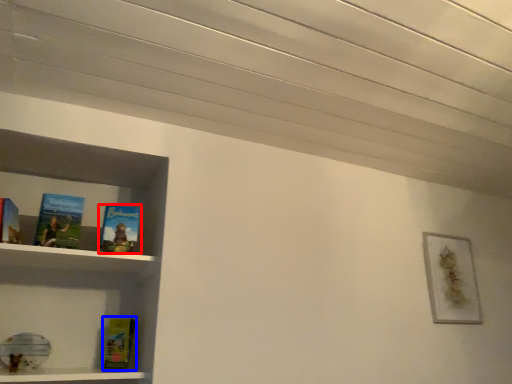
Question: Which object is further to the camera taking this photo, book (highlighted by a red box) or paperback book (highlighted by a blue box)?

Choices:
 (A) book
 (B) paperback book

Answer: (B)